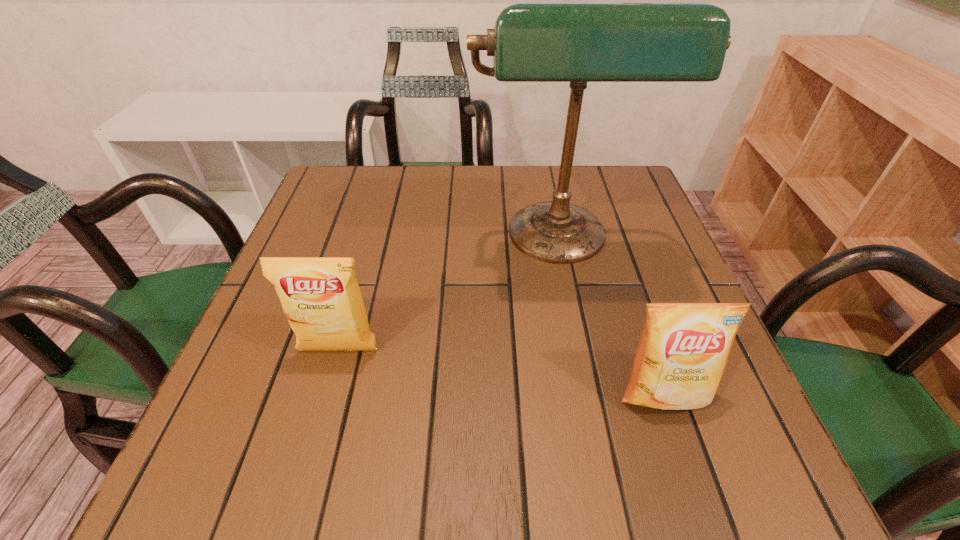
Identify the location of vacant area between the nearer crisp (potato chip) and the farthest object. (611, 318).

Where is `the second closest object to the right crisp (potato chip)`? The image size is (960, 540). the second closest object to the right crisp (potato chip) is located at coordinates (321, 298).

Locate which object ranks in proximity to the nearer crisp (potato chip). Please provide its 2D coordinates. Your answer should be formatted as a tuple, i.e. [(x, y)], where the tuple contains the x and y coordinates of a point satisfying the conditions above.

[(578, 43)]